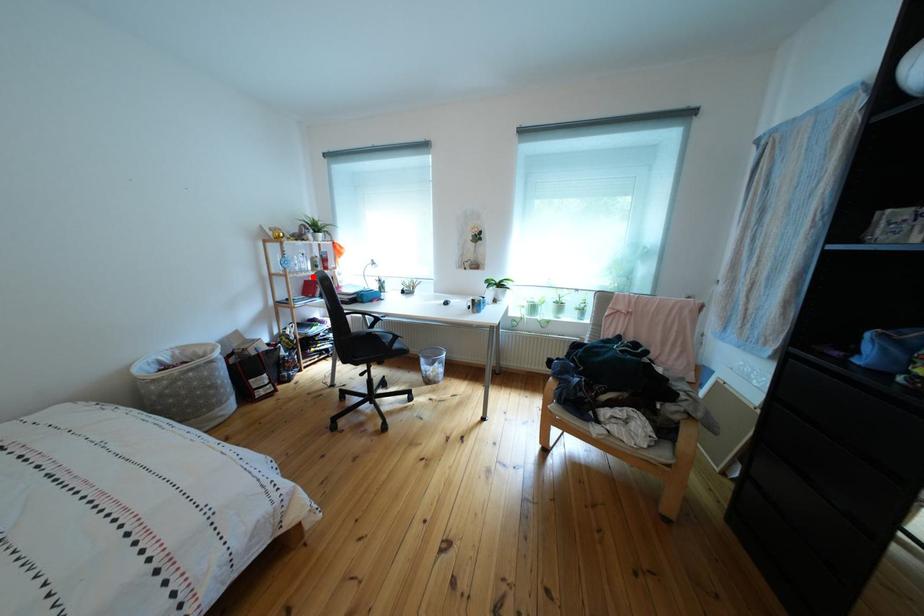
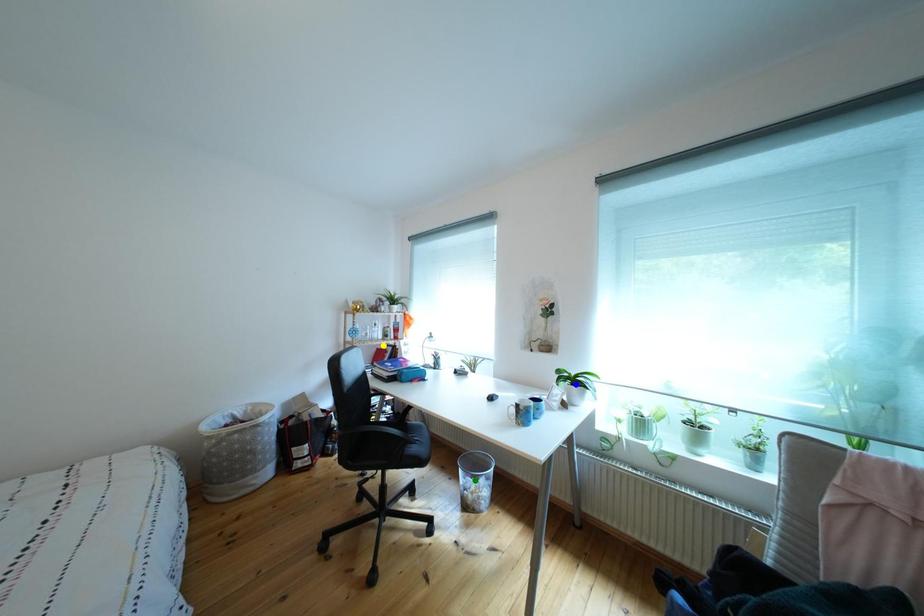
Question: I am providing you with two images of the same scene from different viewpoints. A red point is marked on the first image. You are given multiple points on the second image. In image 2, which mark is for the same physical point as the one in image 1?

Choices:
 (A) green point
 (B) blue point
 (C) yellow point

Answer: (C)